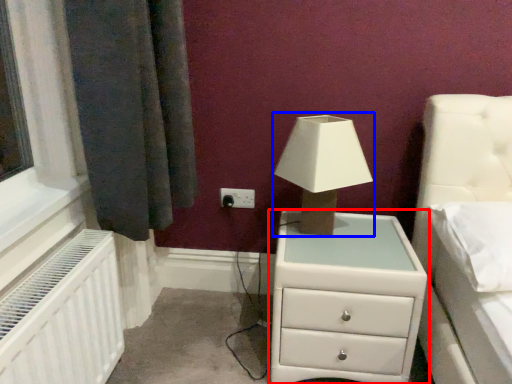
Question: Which object is closer to the camera taking this photo, chest of drawers (highlighted by a red box) or table lamp (highlighted by a blue box)?

Choices:
 (A) chest of drawers
 (B) table lamp

Answer: (A)